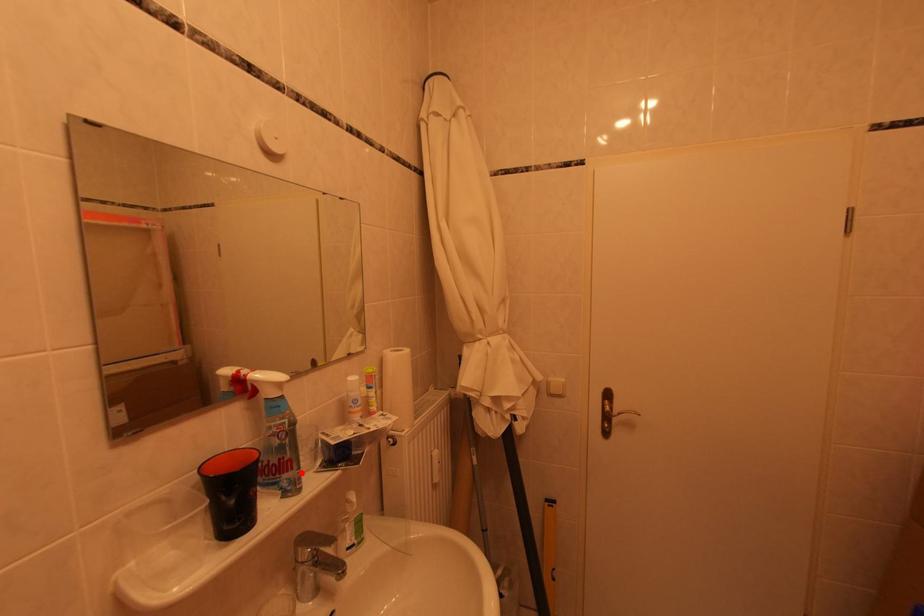
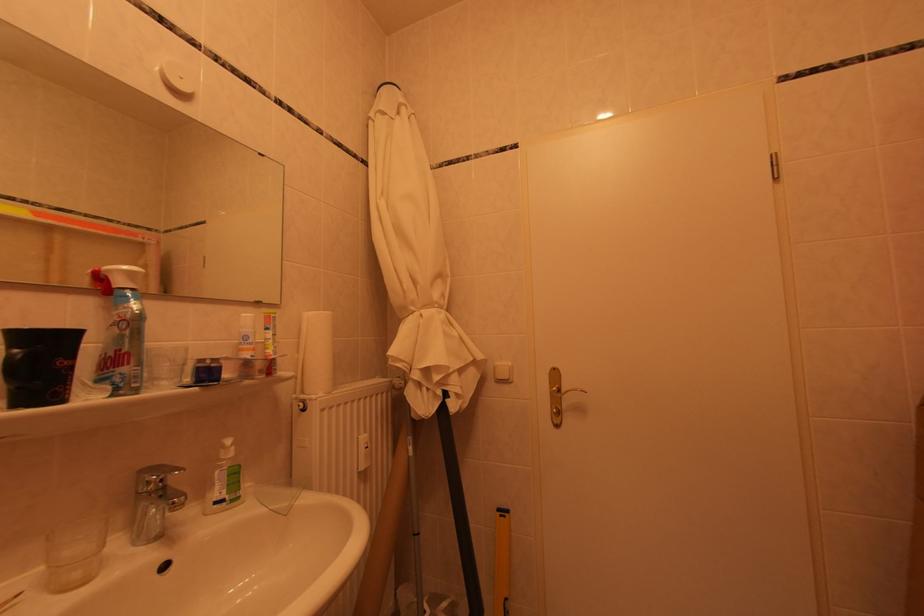
Where in the second image is the point corresponding to the highlighted location from the first image?

(138, 368)